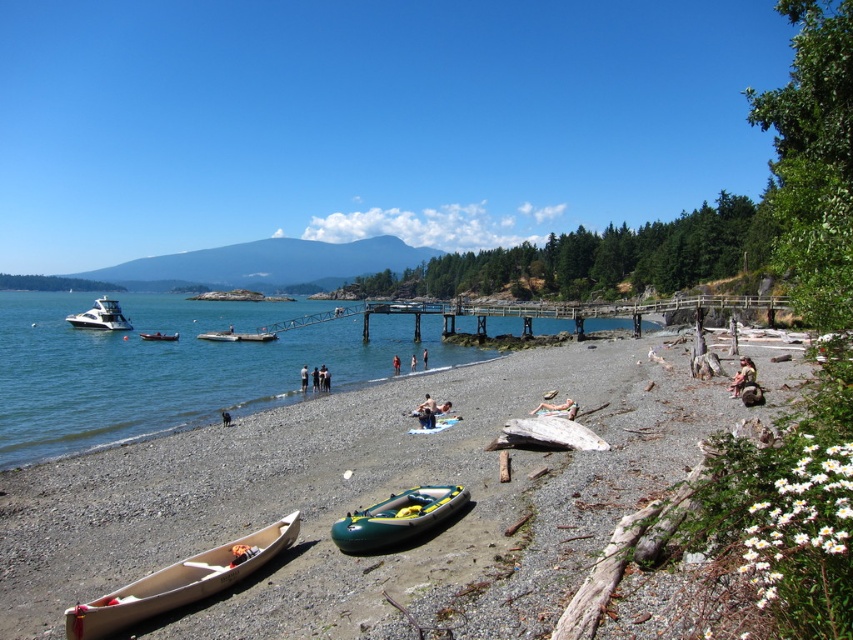
Describe the element at coordinates (102, 316) in the screenshot. I see `shiny white motorboat at left` at that location.

Which is more to the left, shiny white motorboat at left or tan fabric towel at center?

Positioned to the left is shiny white motorboat at left.

Is point (103, 317) less distant than point (424, 348)?

No, it is not.

You are a GUI agent. You are given a task and a screenshot of the screen. Output one action in this format:
    pyautogui.click(x=<x>, y=<y>)
    Task: Click on the shiny white motorboat at left
    
    Given the screenshot: What is the action you would take?
    pyautogui.click(x=102, y=316)

What do you see at coordinates (556, 408) in the screenshot? Image resolution: width=853 pixels, height=640 pixels. I see `tan fabric towel at lower center` at bounding box center [556, 408].

Is point (548, 412) closer to viewer compared to point (425, 369)?

Yes, it is.

What are the coordinates of `tan fabric towel at lower center` in the screenshot? It's located at (556, 408).

Does point (144, 333) come closer to viewer compared to point (396, 355)?

No, it is behind (396, 355).

Between point (166, 339) and point (397, 372), which one is positioned behind?

The point (166, 339) is more distant.

Looking at this image, who is more distant from viewer, (164,333) or (393,358)?

Positioned behind is point (164,333).

The height and width of the screenshot is (640, 853). In order to click on white plastic boat at left in this screenshot , I will do `click(160, 337)`.